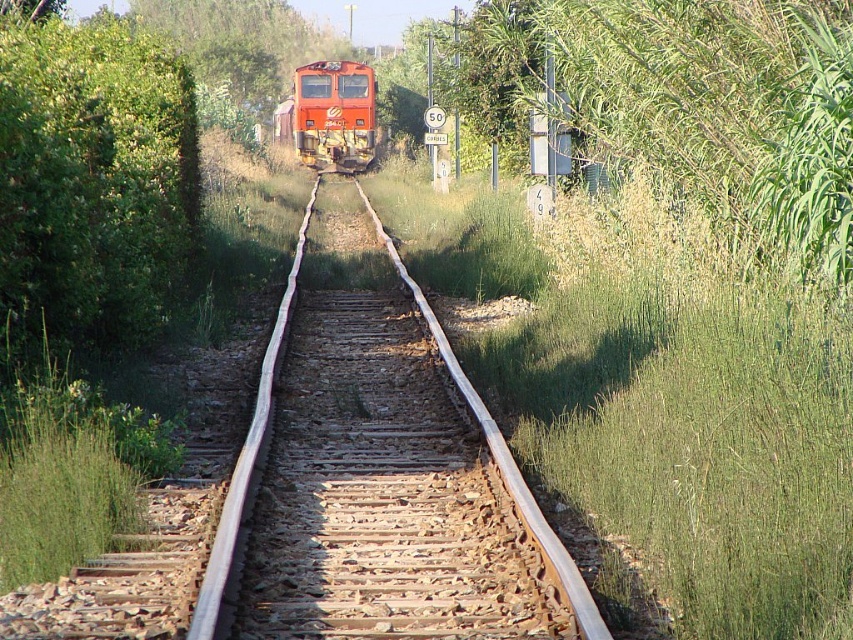
Between rusty metal track at center and green leafy tree at upper center, which one appears on the right side from the viewer's perspective?

rusty metal track at center

From the picture: Is rusty metal track at center positioned in front of green leafy tree at upper center?

Yes.

Is point (601, 636) farther from viewer compared to point (204, 36)?

That is False.

At what (x,y) coordinates should I click in order to perform the action: click on rusty metal track at center. Please return your answer as a coordinate pair (x, y). The width and height of the screenshot is (853, 640). Looking at the image, I should click on (381, 492).

Is green leafy bush at left to the right of green leafy tree at upper center from the viewer's perspective?

Correct, you'll find green leafy bush at left to the right of green leafy tree at upper center.

This screenshot has width=853, height=640. Describe the element at coordinates (91, 180) in the screenshot. I see `green leafy bush at left` at that location.

Find the location of a particular element. The height and width of the screenshot is (640, 853). green leafy bush at left is located at coordinates (91, 180).

Which is more to the left, rusty metal track at center or green leafy bush at left?

green leafy bush at left is more to the left.

Is point (193, 627) closer to camera compared to point (189, 109)?

Yes.

This screenshot has width=853, height=640. Identify the location of rusty metal track at center. (381, 492).